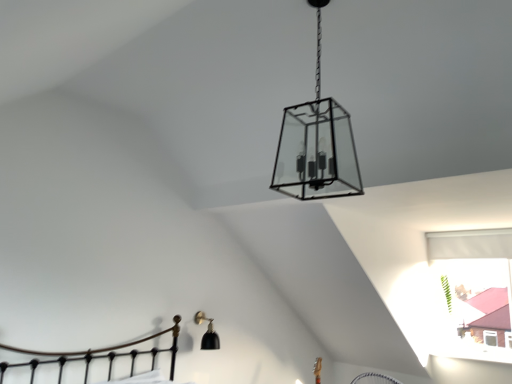
Question: Looking at their shapes, would you say clear glass lantern at center, the 1th lamp positioned from the right, is wider or thinner than black matte wall sconce at lower left, which is the first lamp from back to front?

Choices:
 (A) wide
 (B) thin

Answer: (A)

Question: Considering the positions of clear glass lantern at center, arranged as the 2th lamp when viewed from the left, and black matte wall sconce at lower left, the 2th lamp positioned from the top, in the image, is clear glass lantern at center, arranged as the 2th lamp when viewed from the left, bigger or smaller than black matte wall sconce at lower left, the 2th lamp positioned from the top,?

Choices:
 (A) small
 (B) big

Answer: (B)

Question: In terms of height, does clear glass lantern at center, the 1th lamp in the top-to-bottom sequence, look taller or shorter compared to black matte wall sconce at lower left, placed as the second lamp when sorted from right to left?

Choices:
 (A) short
 (B) tall

Answer: (B)

Question: From the image's perspective, is black matte wall sconce at lower left, the 2th lamp positioned from the top, above or below clear glass lantern at center, the 1th lamp positioned from the right?

Choices:
 (A) below
 (B) above

Answer: (A)

Question: Is point (208, 349) positioned closer to the camera than point (287, 172)?

Choices:
 (A) closer
 (B) farther

Answer: (B)

Question: Considering the relative positions of black matte wall sconce at lower left, placed as the second lamp when sorted from right to left, and clear glass lantern at center, acting as the 2th lamp starting from the back, in the image provided, is black matte wall sconce at lower left, placed as the second lamp when sorted from right to left, to the left or to the right of clear glass lantern at center, acting as the 2th lamp starting from the back,?

Choices:
 (A) left
 (B) right

Answer: (A)

Question: In terms of height, does black matte wall sconce at lower left, which appears as the 1th lamp when viewed from the left, look taller or shorter compared to clear glass lantern at center, arranged as the 2th lamp when viewed from the left?

Choices:
 (A) short
 (B) tall

Answer: (A)